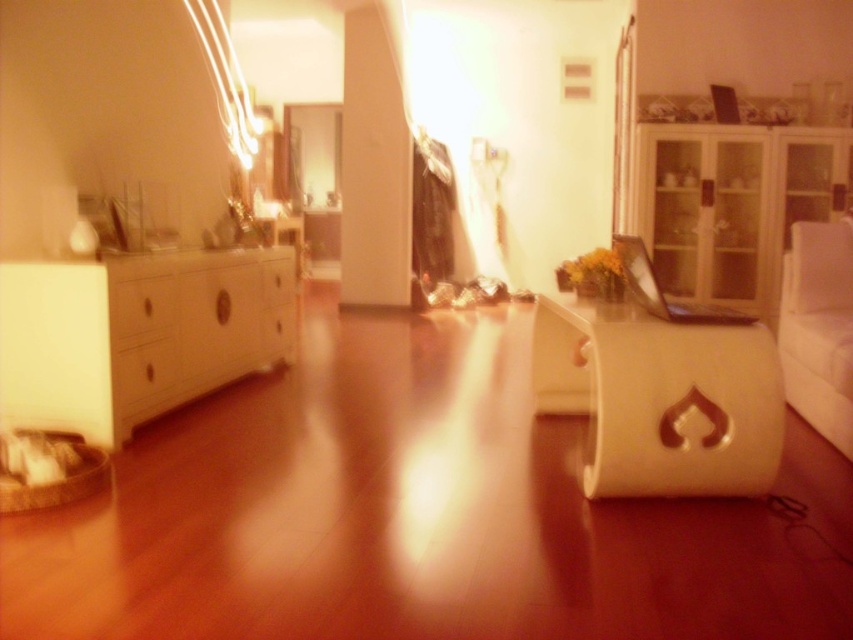
Is white matte cylindrical at center thinner than transparent glass cabinet at right?

Correct, white matte cylindrical at center's width is less than transparent glass cabinet at right's.

What do you see at coordinates (662, 397) in the screenshot?
I see `white matte cylindrical at center` at bounding box center [662, 397].

I want to click on white matte cylindrical at center, so click(x=662, y=397).

Who is more forward, (601,330) or (844,451)?

Positioned in front is point (601,330).

Is white matte cylindrical at center positioned behind white fabric couch at right?

No, white matte cylindrical at center is in front of white fabric couch at right.

I want to click on white matte cylindrical at center, so click(x=662, y=397).

Does point (828, 227) lie in front of point (282, 280)?

Yes, it is in front of point (282, 280).

From the picture: Between white fabric couch at right and white glossy drawer at center, which one appears on the right side from the viewer's perspective?

From the viewer's perspective, white fabric couch at right appears more on the right side.

What do you see at coordinates (817, 328) in the screenshot? This screenshot has height=640, width=853. I see `white fabric couch at right` at bounding box center [817, 328].

This screenshot has height=640, width=853. Find the location of `white fabric couch at right`. white fabric couch at right is located at coordinates (817, 328).